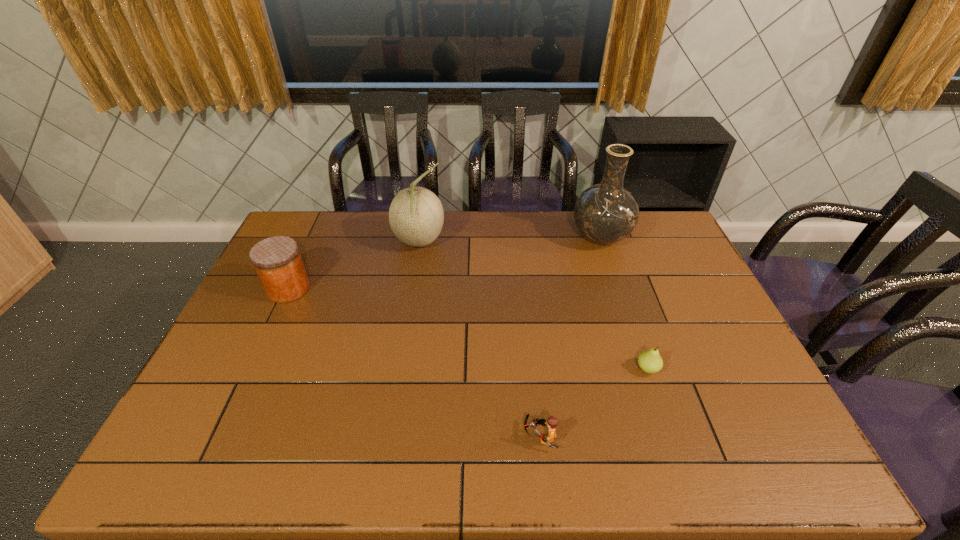
Where is `free space located on the right of the leftmost object`? The height and width of the screenshot is (540, 960). free space located on the right of the leftmost object is located at coordinates (403, 289).

Find the location of a particular element. This screenshot has height=540, width=960. blank space located 0.050m on the front of the second nearest object is located at coordinates (657, 395).

Where is `vacant point located holding a crossbow in the hands of the third object from left to right`? The image size is (960, 540). vacant point located holding a crossbow in the hands of the third object from left to right is located at coordinates (430, 436).

Where is `free location located 0.260m holding a crossbow in the hands of the third object from left to right`? Image resolution: width=960 pixels, height=540 pixels. free location located 0.260m holding a crossbow in the hands of the third object from left to right is located at coordinates (414, 436).

Locate an element on the screen. Image resolution: width=960 pixels, height=540 pixels. free region located holding a crossbow in the hands of the third object from left to right is located at coordinates (493, 436).

Where is `vase present at the far edge`? vase present at the far edge is located at coordinates (x=606, y=213).

Locate an element on the screen. cantaloup located at the far edge is located at coordinates (416, 216).

Find the location of `object that is at the near edge`. object that is at the near edge is located at coordinates (552, 421).

Locate an element on the screen. Image resolution: width=960 pixels, height=540 pixels. object that is at the left edge is located at coordinates (277, 260).

This screenshot has height=540, width=960. I want to click on vacant space at the far edge of the desktop, so 373,249.